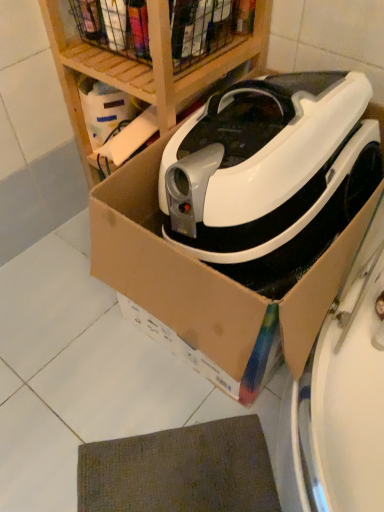
You are a GUI agent. You are given a task and a screenshot of the screen. Output one action in this format:
    pyautogui.click(x=<x>, y=<y>)
    Task: Click on the vacant point above brown textured mat at lower center (from a real-world perspective)
    Image resolution: width=384 pixels, height=512 pixels.
    Given the screenshot: What is the action you would take?
    pyautogui.click(x=175, y=473)